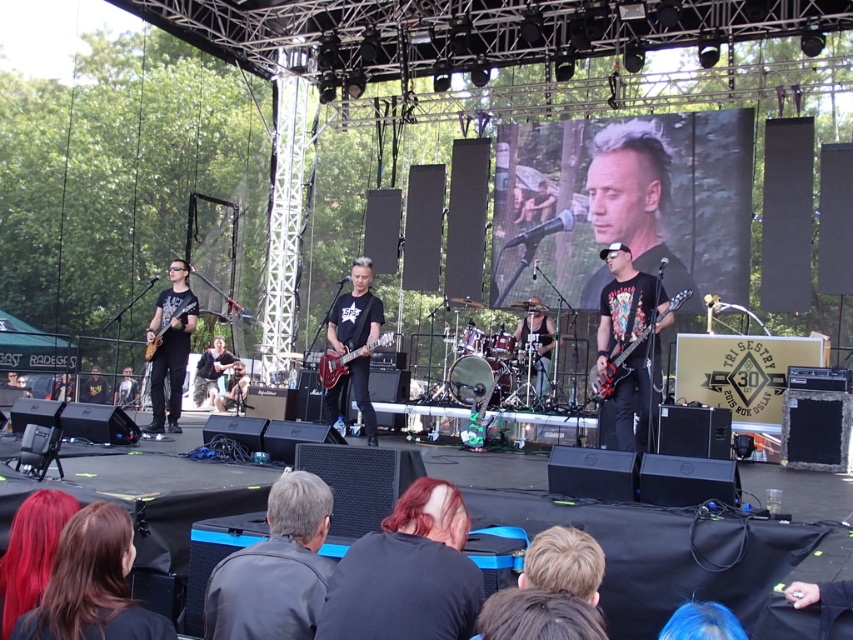
Question: From the image, what is the correct spatial relationship of matte black guitar at center in relation to glossy wood electric guitar at center?

Choices:
 (A) above
 (B) below

Answer: (B)

Question: Can you confirm if dark brown hair at lower center is positioned to the right of glossy black electric guitar at left?

Choices:
 (A) yes
 (B) no

Answer: (A)

Question: Can you confirm if glossy wood electric guitar at center is smaller than glossy black electric guitar at left?

Choices:
 (A) yes
 (B) no

Answer: (B)

Question: Which point is farther to the camera?

Choices:
 (A) matte black guitar at left
 (B) matte black guitar at center
 (C) glossy wood electric guitar at center

Answer: (A)

Question: Which point is closer to the camera?

Choices:
 (A) (288, 572)
 (B) (173, 396)
 (C) (149, 342)
 (D) (424, 500)

Answer: (D)

Question: Considering the real-world distances, which object is farthest from the shiny red hair at lower left?

Choices:
 (A) glossy black electric guitar at left
 (B) matte black guitar at left
 (C) dark brown hair at lower center

Answer: (A)